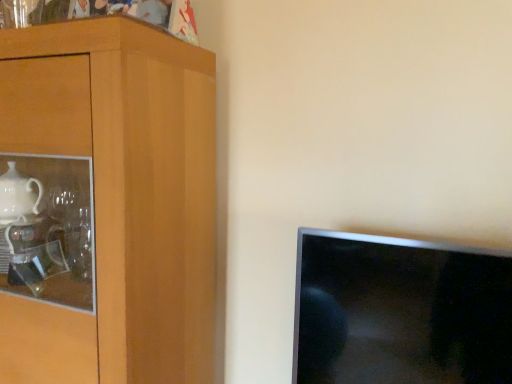
Identify the location of wooden cabinet at left. The height and width of the screenshot is (384, 512). (121, 197).

Describe the element at coordinates (121, 197) in the screenshot. This screenshot has width=512, height=384. I see `wooden cabinet at left` at that location.

Locate an element on the screen. The image size is (512, 384). wooden cabinet at left is located at coordinates (121, 197).